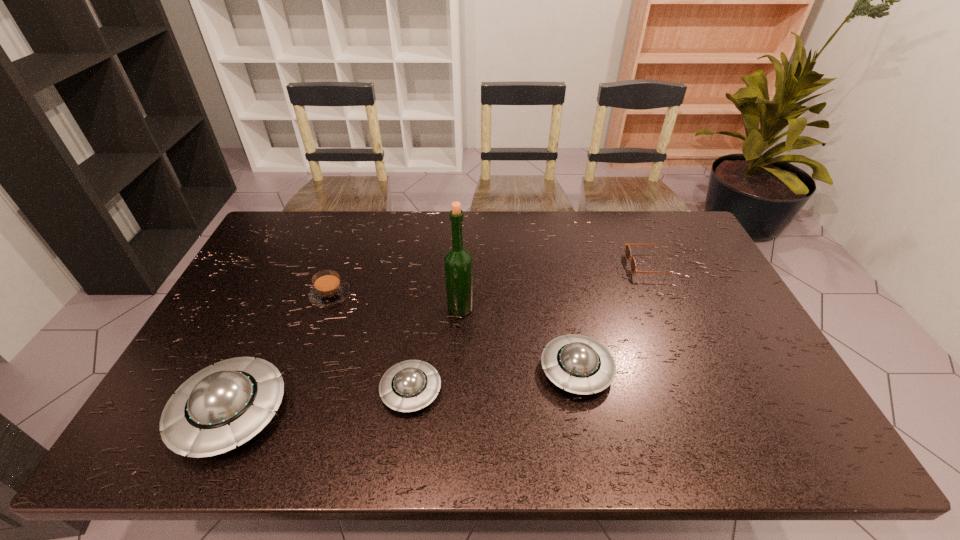
The width and height of the screenshot is (960, 540). Find the location of `the second tallest object`. the second tallest object is located at coordinates (226, 404).

Locate an element on the screen. This screenshot has height=540, width=960. the tallest saucer is located at coordinates (226, 404).

Find the location of `the shortest saucer`. the shortest saucer is located at coordinates (410, 385).

The image size is (960, 540). Find the location of `the second object from right to left`. the second object from right to left is located at coordinates (576, 363).

Locate an element on the screen. This screenshot has width=960, height=540. the third tallest object is located at coordinates (576, 363).

In order to click on cappuccino in this screenshot , I will do `click(329, 290)`.

The image size is (960, 540). Find the location of `the rightmost object`. the rightmost object is located at coordinates (633, 266).

Where is `the farthest object`? This screenshot has height=540, width=960. the farthest object is located at coordinates (633, 266).

You are a GUI agent. You are given a task and a screenshot of the screen. Output one action in this format:
    pyautogui.click(x=<x>, y=<y>)
    Task: Click on the liquor
    
    Given the screenshot: What is the action you would take?
    pyautogui.click(x=458, y=262)

At what (x,y) coordinates should I click in order to perform the action: click on vacant space situated 0.400m on the right of the tallest saucer. Please return your answer as a coordinate pair (x, y). The width and height of the screenshot is (960, 540). Looking at the image, I should click on (455, 413).